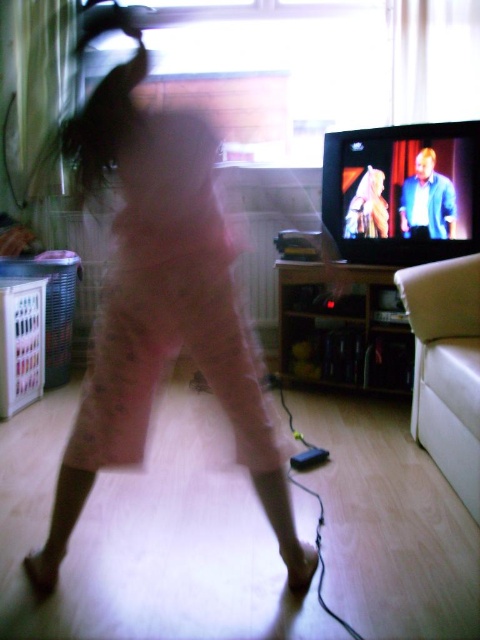
Question: Does pink fabric skirt at center appear under matte plastic tv at upper right?

Choices:
 (A) yes
 (B) no

Answer: (A)

Question: Which point is farther from the camera taking this photo?

Choices:
 (A) (175, 209)
 (B) (327, 227)

Answer: (B)

Question: Among these objects, which one is nearest to the camera?

Choices:
 (A) matte plastic tv at upper right
 (B) pink fabric skirt at center

Answer: (B)

Question: Among these points, which one is nearest to the camera?

Choices:
 (A) (276, 465)
 (B) (441, 182)

Answer: (A)

Question: Can you confirm if pink fabric skirt at center is thinner than matte plastic tv at upper right?

Choices:
 (A) yes
 (B) no

Answer: (B)

Question: From the image, what is the correct spatial relationship of pink fabric skirt at center in relation to matte plastic tv at upper right?

Choices:
 (A) below
 (B) above

Answer: (A)